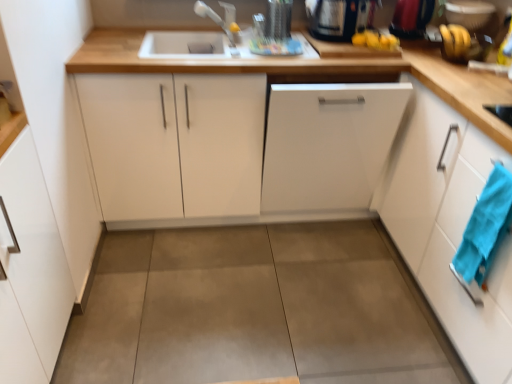
Question: Could you tell me if white matte dishwasher at center, positioned as the 2th cabinetry in right-to-left order, is turned towards black glossy kettle at upper right, which appears as the 3th appliance when viewed from the right?

Choices:
 (A) no
 (B) yes

Answer: (A)

Question: Can you confirm if white matte dishwasher at center, positioned as the 2th cabinetry in right-to-left order, is shorter than black glossy kettle at upper right, which ranks as the 1th appliance in left-to-right order?

Choices:
 (A) yes
 (B) no

Answer: (B)

Question: Considering the relative sizes of white matte dishwasher at center, positioned as the 2th cabinetry in right-to-left order, and black glossy kettle at upper right, which appears as the 3th appliance when viewed from the right, in the image provided, is white matte dishwasher at center, positioned as the 2th cabinetry in right-to-left order, taller than black glossy kettle at upper right, which appears as the 3th appliance when viewed from the right,?

Choices:
 (A) yes
 (B) no

Answer: (A)

Question: Are white matte dishwasher at center, the third cabinetry viewed from the left, and black glossy kettle at upper right, which appears as the 3th appliance when viewed from the right, beside each other?

Choices:
 (A) yes
 (B) no

Answer: (B)

Question: Considering the relative sizes of white matte dishwasher at center, the third cabinetry viewed from the left, and black glossy kettle at upper right, which appears as the 3th appliance when viewed from the right, in the image provided, is white matte dishwasher at center, the third cabinetry viewed from the left, wider than black glossy kettle at upper right, which appears as the 3th appliance when viewed from the right,?

Choices:
 (A) yes
 (B) no

Answer: (A)

Question: Visually, is concretesmoothfloor at center positioned to the left or to the right of black glossy kettle at upper right, which ranks as the 1th appliance in left-to-right order?

Choices:
 (A) left
 (B) right

Answer: (A)

Question: Considering the positions of concretesmoothfloor at center and black glossy kettle at upper right, which appears as the 3th appliance when viewed from the right, in the image, is concretesmoothfloor at center wider or thinner than black glossy kettle at upper right, which appears as the 3th appliance when viewed from the right,?

Choices:
 (A) wide
 (B) thin

Answer: (A)

Question: Based on their sizes in the image, would you say concretesmoothfloor at center is bigger or smaller than black glossy kettle at upper right, which appears as the 3th appliance when viewed from the right?

Choices:
 (A) big
 (B) small

Answer: (A)

Question: Do you think concretesmoothfloor at center is within black glossy kettle at upper right, which appears as the 3th appliance when viewed from the right, or outside of it?

Choices:
 (A) outside
 (B) inside

Answer: (A)

Question: From the image's perspective, is blue fabric hand towel at right above or below metallic silver kettle at upper right, arranged as the second appliance when viewed from the right?

Choices:
 (A) above
 (B) below

Answer: (B)

Question: Visually, is blue fabric hand towel at right positioned to the left or to the right of metallic silver kettle at upper right, the 2th appliance positioned from the left?

Choices:
 (A) left
 (B) right

Answer: (B)

Question: Relative to metallic silver kettle at upper right, arranged as the second appliance when viewed from the right, is blue fabric hand towel at right in front or behind?

Choices:
 (A) front
 (B) behind

Answer: (A)

Question: Is point (479, 268) positioned closer to the camera than point (403, 18)?

Choices:
 (A) farther
 (B) closer

Answer: (B)

Question: Is white matte dishwasher at center, positioned as the 2th cabinetry in right-to-left order, to the left or to the right of white glossy cabinet at right, which is the 1th cabinetry from right to left, in the image?

Choices:
 (A) left
 (B) right

Answer: (A)

Question: From the image's perspective, is white matte dishwasher at center, positioned as the 2th cabinetry in right-to-left order, above or below white glossy cabinet at right, which is the 1th cabinetry from right to left?

Choices:
 (A) above
 (B) below

Answer: (A)